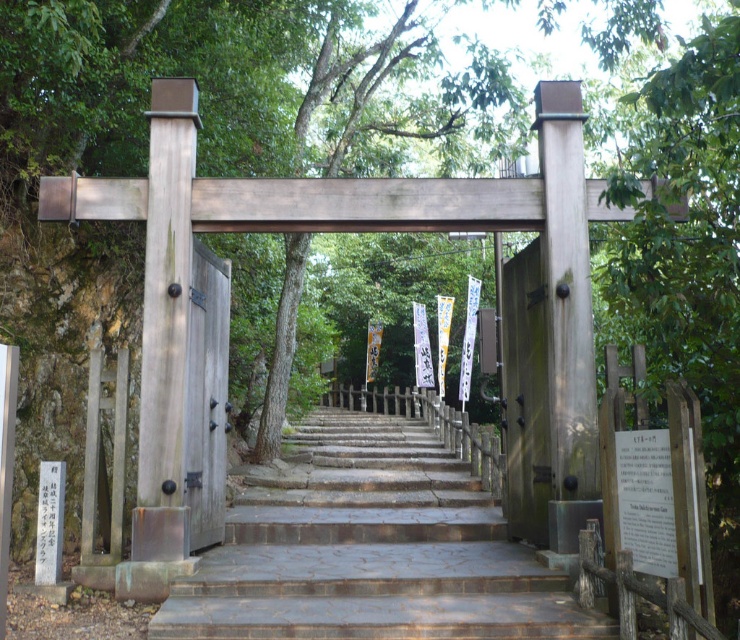
Question: Which point appears closest to the camera in this image?

Choices:
 (A) (198, 532)
 (B) (502, 284)

Answer: (A)

Question: Is brown stone stairs at center to the right of wooden gate at right from the viewer's perspective?

Choices:
 (A) no
 (B) yes

Answer: (A)

Question: Which object is farther from the camera taking this photo?

Choices:
 (A) brown stone stairs at center
 (B) wooden door at center

Answer: (B)

Question: Does brown stone stairs at center lie behind wooden door at center?

Choices:
 (A) yes
 (B) no

Answer: (B)

Question: Considering the real-world distances, which object is closest to the brown stone stairs at center?

Choices:
 (A) wooden gate at right
 (B) wooden door at center

Answer: (A)

Question: Is brown stone stairs at center to the left of wooden door at center from the viewer's perspective?

Choices:
 (A) no
 (B) yes

Answer: (A)